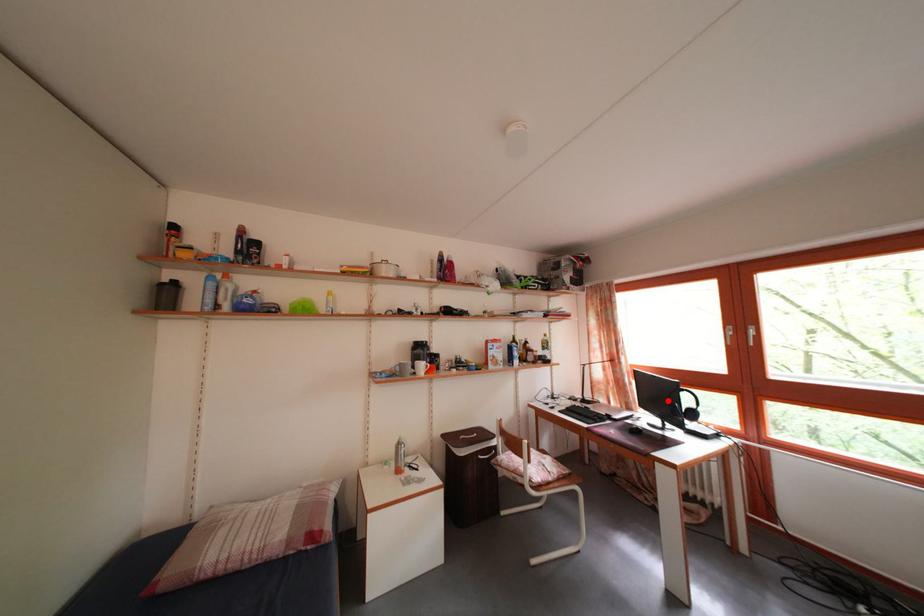
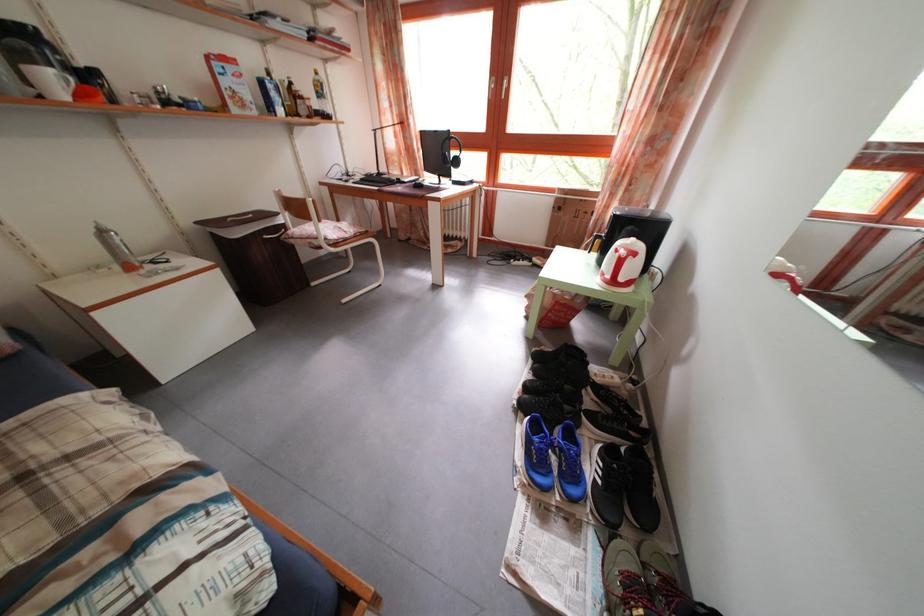
Question: I am providing you with two images of the same scene from different viewpoints. Image1 has a red point marked. In image2, the corresponding 3D location appears at what relative position? Reply with the corresponding letter.

Choices:
 (A) Closer
 (B) Farther

Answer: (A)